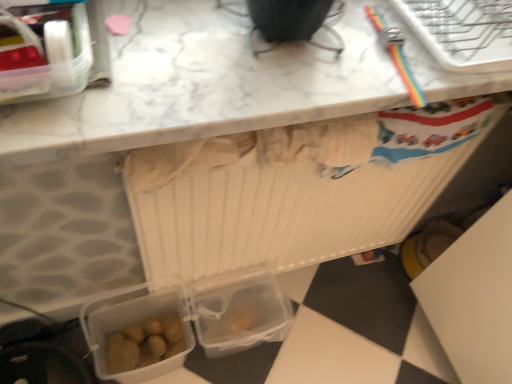
This screenshot has width=512, height=384. Find the location of `vacant space to the right of rainbow plastic bracelet at upper right`. vacant space to the right of rainbow plastic bracelet at upper right is located at coordinates (459, 50).